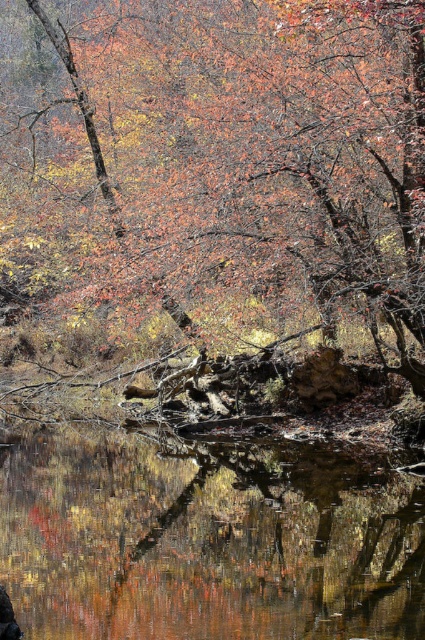
Looking at the autumnal scene by the water, you notice the autumn leaves at center and the transparent water at center. Which object has a greater width in the image?

The autumn leaves at center has a greater width than the transparent water at center.

You are standing by the water and see autumn leaves at center and transparent water at center. Which object is closer to you?

The autumn leaves at center are closer to you because they are positioned over the transparent water at center.